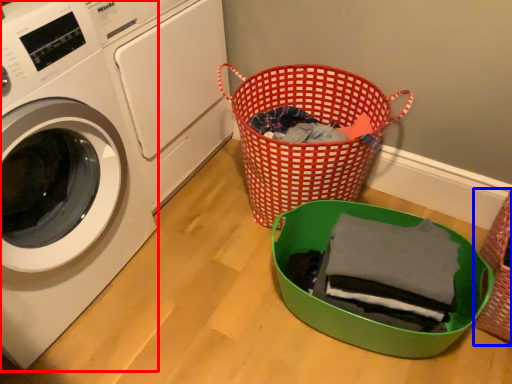
Question: Which point is further to the camera, washing machine (highlighted by a red box) or basket (highlighted by a blue box)?

Choices:
 (A) washing machine
 (B) basket

Answer: (B)